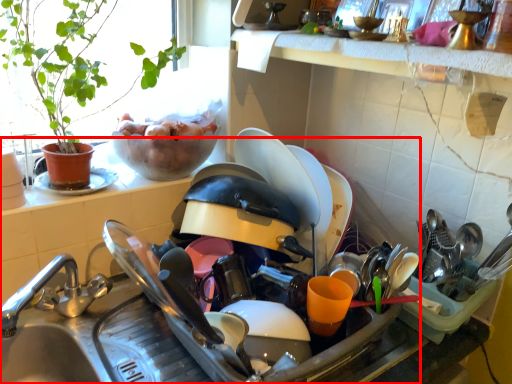
Question: From the image's perspective, where is sink (annotated by the red box) located in relation to window sill in the image?

Choices:
 (A) above
 (B) below

Answer: (B)